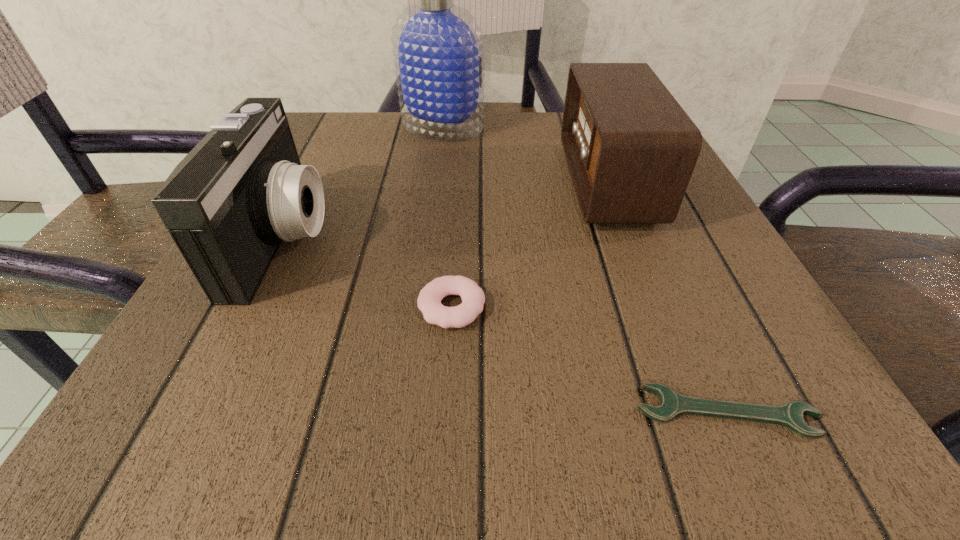
Image resolution: width=960 pixels, height=540 pixels. I want to click on vacant area situated 0.340m on the front-facing side of the radio receiver, so click(x=380, y=183).

Locate an element on the screen. This screenshot has height=540, width=960. vacant area located on the front-facing side of the radio receiver is located at coordinates click(515, 183).

Locate an element on the screen. free spot located on the left of the fourth tallest object is located at coordinates (233, 307).

You are a GUI agent. You are given a task and a screenshot of the screen. Output one action in this format:
    pyautogui.click(x=<x>, y=<y>)
    Task: Click on the vacant space located 0.130m on the left of the shortest object
    Image resolution: width=960 pixels, height=540 pixels.
    Given the screenshot: What is the action you would take?
    pyautogui.click(x=515, y=411)

Find the location of a particular element. cleansing agent that is at the far edge is located at coordinates (438, 46).

You are a GUI agent. You are given a task and a screenshot of the screen. Output one action in this format:
    pyautogui.click(x=<x>, y=<y>)
    Task: Click on the radio receiver that is at the far edge
    Image resolution: width=960 pixels, height=540 pixels.
    Given the screenshot: What is the action you would take?
    pyautogui.click(x=631, y=149)

At what (x,y) coordinates should I click in order to perform the action: click on object located in the near edge section of the desktop. Please return your answer as a coordinate pair (x, y). The height and width of the screenshot is (540, 960). Looking at the image, I should click on (672, 404).

At what (x,y) coordinates should I click in order to perform the action: click on object that is at the left edge. Please return your answer as a coordinate pair (x, y). Looking at the image, I should click on (228, 205).

Identify the location of radio receiver positioned at the right edge. The image size is (960, 540). (631, 149).

At what (x,y) coordinates should I click in order to perform the action: click on wrench located in the right edge section of the desktop. Please return your answer as a coordinate pair (x, y). The height and width of the screenshot is (540, 960). Looking at the image, I should click on (672, 404).